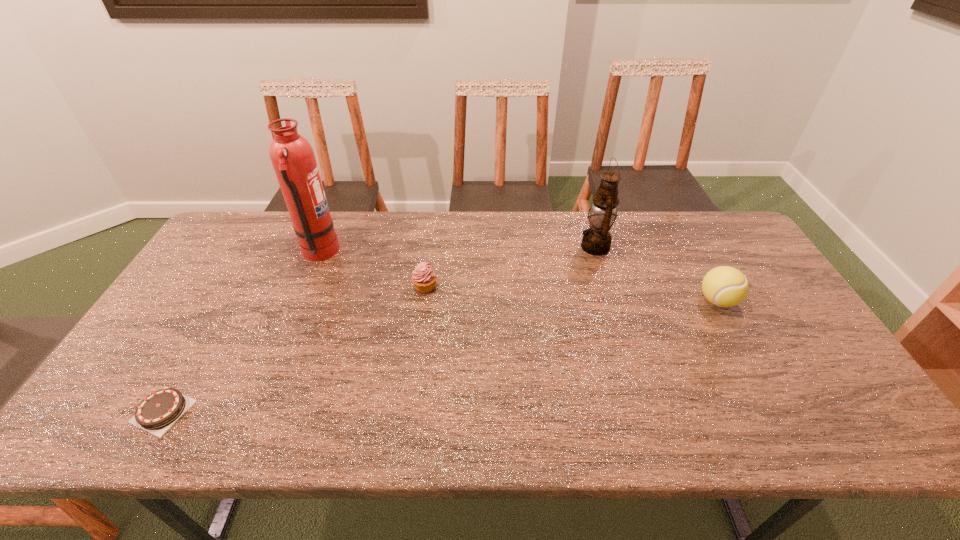
I want to click on vacant region that satisfies the following two spatial constraints: 1. on the back side of the third tallest object; 2. on the label side of the fourth object from right to left, so click(x=691, y=253).

I want to click on free space that satisfies the following two spatial constraints: 1. on the front side of the second tallest object; 2. on the left side of the rightmost object, so click(612, 301).

This screenshot has width=960, height=540. In order to click on blank area in the image that satisfies the following two spatial constraints: 1. on the front side of the third object from right to left; 2. on the right side of the tennis ball in this screenshot , I will do `click(423, 301)`.

You are a GUI agent. You are given a task and a screenshot of the screen. Output one action in this format:
    pyautogui.click(x=<x>, y=<y>)
    Task: Click on the vacant area that satisfies the following two spatial constraints: 1. on the label side of the fourth object from right to left; 2. on the right side of the rightmost object
    Image resolution: width=960 pixels, height=540 pixels.
    Given the screenshot: What is the action you would take?
    pyautogui.click(x=300, y=301)